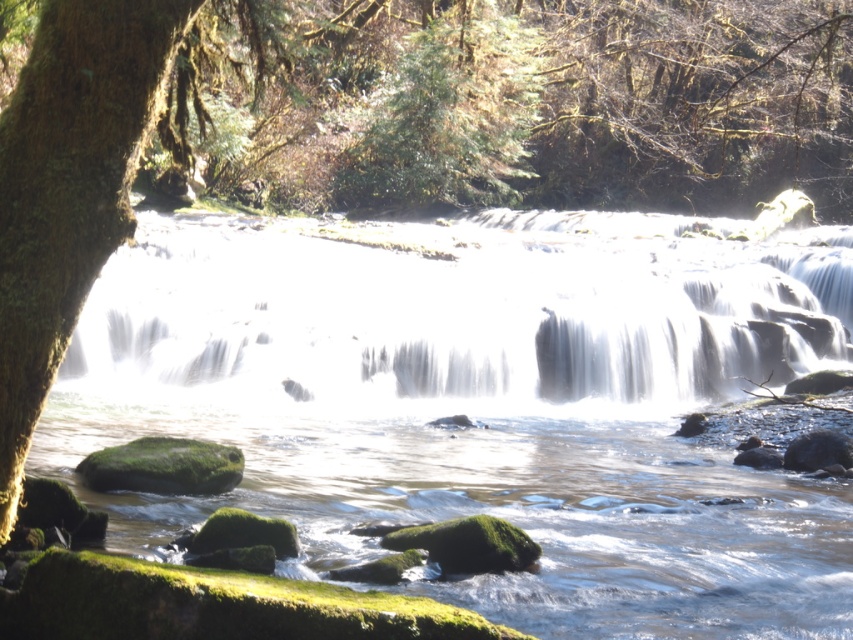
How much distance is there between clear water at center and white frothy water at center?

clear water at center is 1.06 meters away from white frothy water at center.

Looking at this image, can you confirm if clear water at center is smaller than white frothy water at center?

Incorrect, clear water at center is not smaller in size than white frothy water at center.

The height and width of the screenshot is (640, 853). What are the coordinates of `clear water at center` in the screenshot? It's located at (482, 404).

Where is `clear water at center`? The width and height of the screenshot is (853, 640). clear water at center is located at coordinates (482, 404).

What do you see at coordinates (68, 188) in the screenshot? This screenshot has width=853, height=640. I see `green mossy tree trunk at left` at bounding box center [68, 188].

Does point (125, 232) come behind point (393, 196)?

No, (125, 232) is closer to viewer.

Locate an element on the screen. The image size is (853, 640). green mossy tree trunk at left is located at coordinates (68, 188).

You are a GUI agent. You are given a task and a screenshot of the screen. Output one action in this format:
    pyautogui.click(x=<x>, y=<y>)
    Task: Click on the green mossy tree trunk at left
    The width and height of the screenshot is (853, 640).
    Given the screenshot: What is the action you would take?
    pyautogui.click(x=68, y=188)

Does white frothy water at center come in front of green mossy tree trunk at left?

No, it is not.

Can you confirm if white frothy water at center is bigger than green mossy tree trunk at left?

Yes.

Image resolution: width=853 pixels, height=640 pixels. What do you see at coordinates (463, 310) in the screenshot?
I see `white frothy water at center` at bounding box center [463, 310].

This screenshot has height=640, width=853. Find the location of `white frothy water at center`. white frothy water at center is located at coordinates (463, 310).